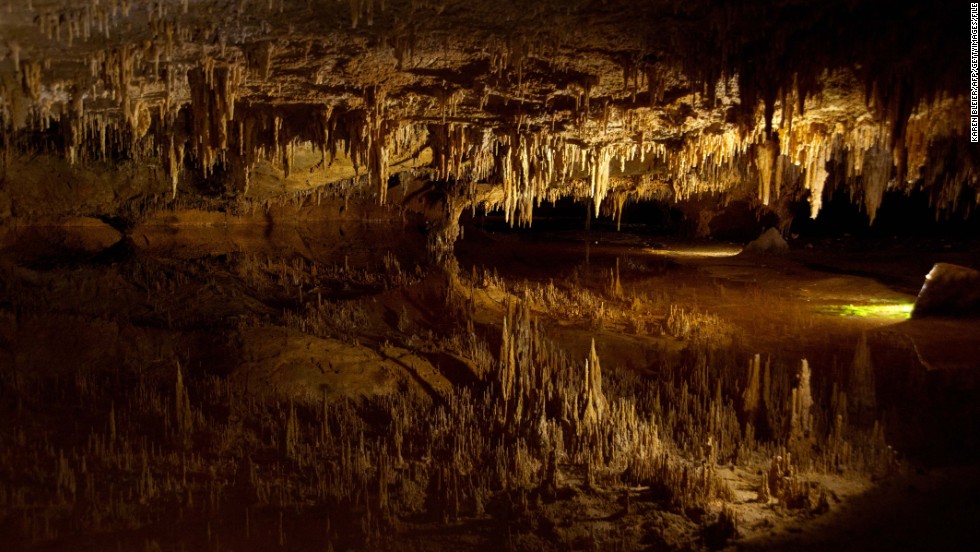
Where is `ceiling`? This screenshot has width=980, height=552. ceiling is located at coordinates (297, 88), (487, 79), (586, 78).